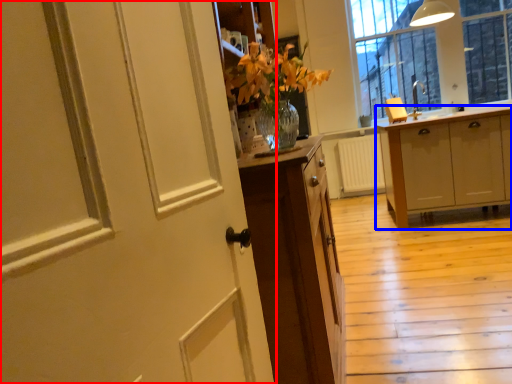
Question: Among these objects, which one is nearest to the camera, door (highlighted by a red box) or cabinetry (highlighted by a blue box)?

Choices:
 (A) door
 (B) cabinetry

Answer: (A)